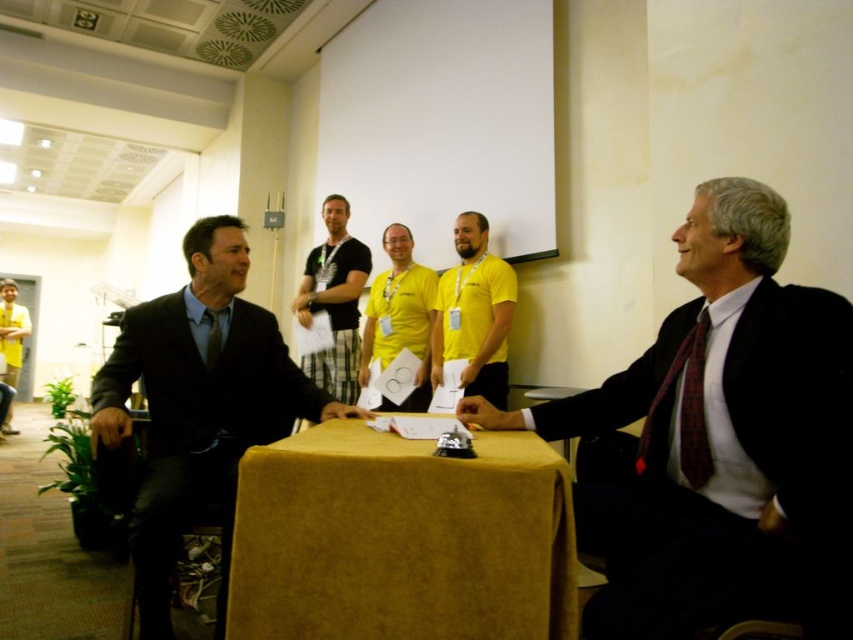
Question: Is yellow fabric shirt at center positioned behind matte black tie at center?

Choices:
 (A) no
 (B) yes

Answer: (B)

Question: Estimate the real-world distances between objects in this image. Which object is closer to the yellow t-shirt at center?

Choices:
 (A) matte black suit at center
 (B) yellow fabric table at center
 (C) black t-shirt at center

Answer: (C)

Question: Which of the following is the farthest from the observer?

Choices:
 (A) yellow fabric table at center
 (B) matte black tie at center

Answer: (B)

Question: Does black suit at left have a greater width compared to yellow matte shirt at center?

Choices:
 (A) no
 (B) yes

Answer: (B)

Question: Can you confirm if yellow fabric table at center is positioned above yellow matte shirt at center?

Choices:
 (A) no
 (B) yes

Answer: (A)

Question: Which point appears closest to the camera in this image?

Choices:
 (A) (215, 332)
 (B) (801, 316)
 (C) (16, 429)

Answer: (B)